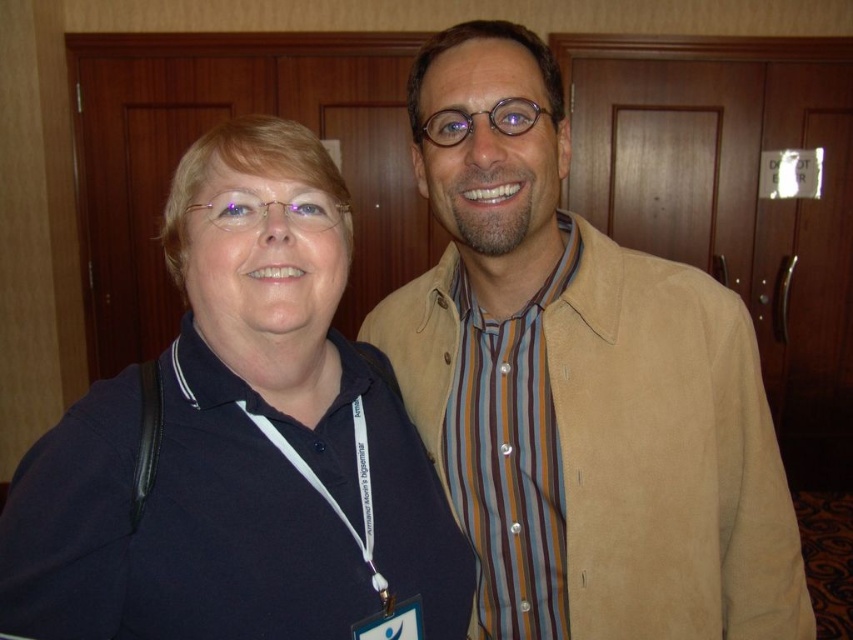
Does suede jacket at center have a lesser height compared to striped fabric shirt at right?

Incorrect, suede jacket at center's height does not fall short of striped fabric shirt at right's.

Is suede jacket at center above striped fabric shirt at right?

Yes.

Is point (573, 490) less distant than point (544, 541)?

Yes, it is in front of point (544, 541).

Locate an element on the screen. The width and height of the screenshot is (853, 640). suede jacket at center is located at coordinates 579,385.

Does suede jacket at center have a lesser height compared to matte black polo shirt at left?

No.

Who is more distant from viewer, [544,323] or [144,577]?

The point [544,323] is behind.

Find the location of a particular element. suede jacket at center is located at coordinates (579, 385).

Based on the photo, can you confirm if matte black polo shirt at left is shorter than striped fabric shirt at right?

No, matte black polo shirt at left is not shorter than striped fabric shirt at right.

Between point (177, 344) and point (543, 588), which one is positioned behind?

Positioned behind is point (543, 588).

Locate an element on the screen. The height and width of the screenshot is (640, 853). matte black polo shirt at left is located at coordinates (241, 444).